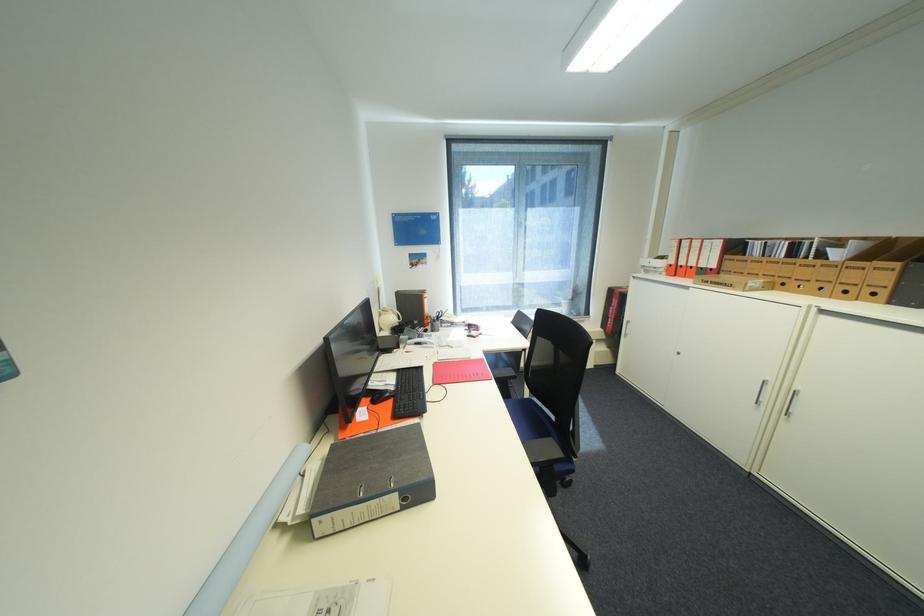
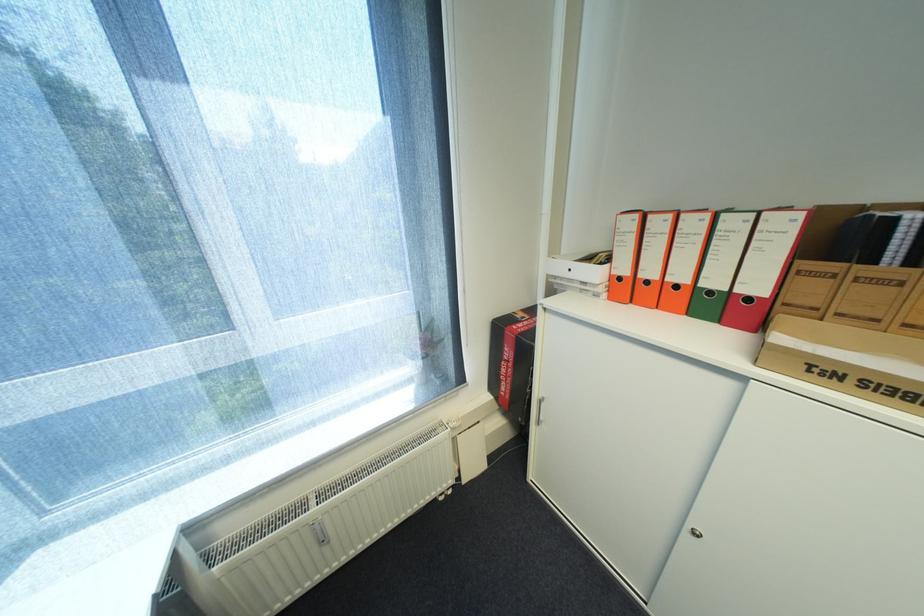
In the second image, find the point that corresponds to point (699, 268) in the first image.

(685, 286)